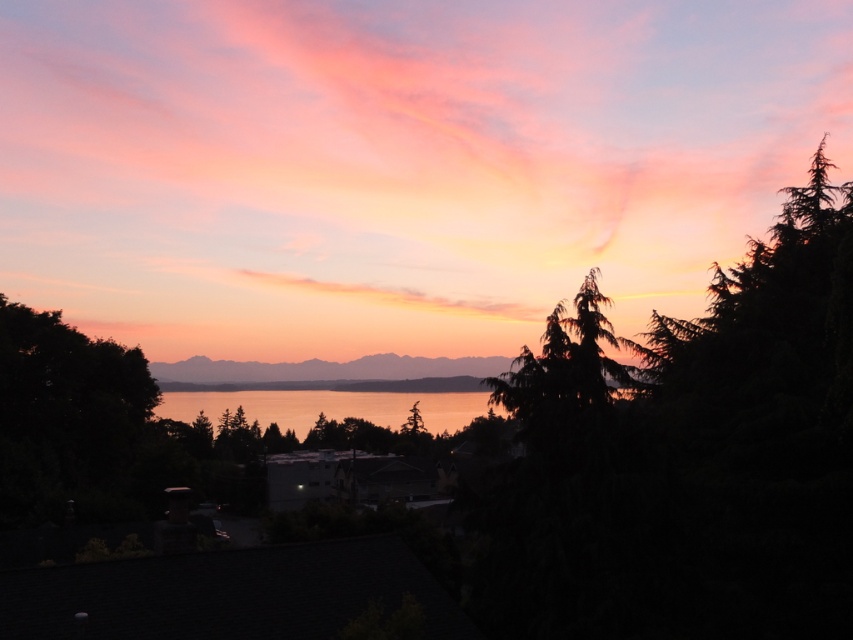
Question: Which object appears farthest from the camera in this image?

Choices:
 (A) golden reflective water at center
 (B) green textured pine tree at center

Answer: (A)

Question: Which point is closer to the camera taking this photo?

Choices:
 (A) (579, 324)
 (B) (334, 412)

Answer: (A)

Question: Does green textured pine tree at center have a greater width compared to golden reflective water at center?

Choices:
 (A) no
 (B) yes

Answer: (A)

Question: Can you confirm if green textured pine tree at center is thinner than golden reflective water at center?

Choices:
 (A) no
 (B) yes

Answer: (B)

Question: Which of the following is the farthest from the observer?

Choices:
 (A) (346, 410)
 (B) (584, 307)

Answer: (A)

Question: Does green textured pine tree at center appear on the right side of golden reflective water at center?

Choices:
 (A) yes
 (B) no

Answer: (A)